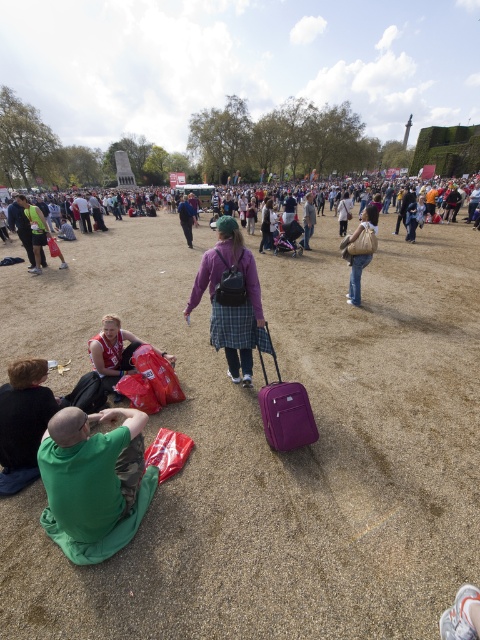
Based on the photo, you are standing at the edge of the gathering area and see the matte red backpack at lower left and the beige fabric bag at center. Which bag is closer to your left side?

The matte red backpack at lower left is closer to your left side because it is positioned to the left of the beige fabric bag at center.

You are organizing a picnic and need to place your items. You have a purple matte suitcase at center and a blue denim jacket at center. Which item is located to the right of the other?

The purple matte suitcase at center is positioned on the right side of blue denim jacket at center.